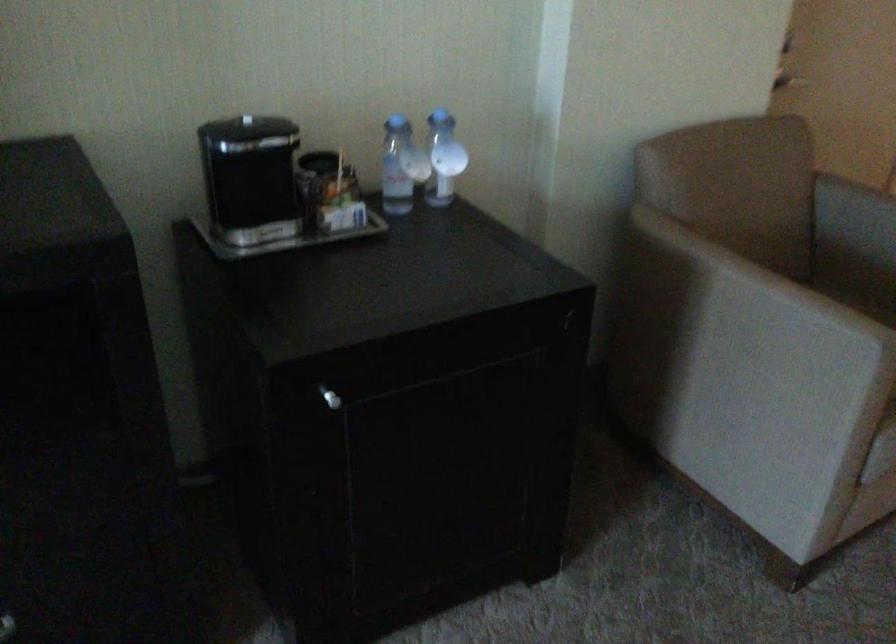
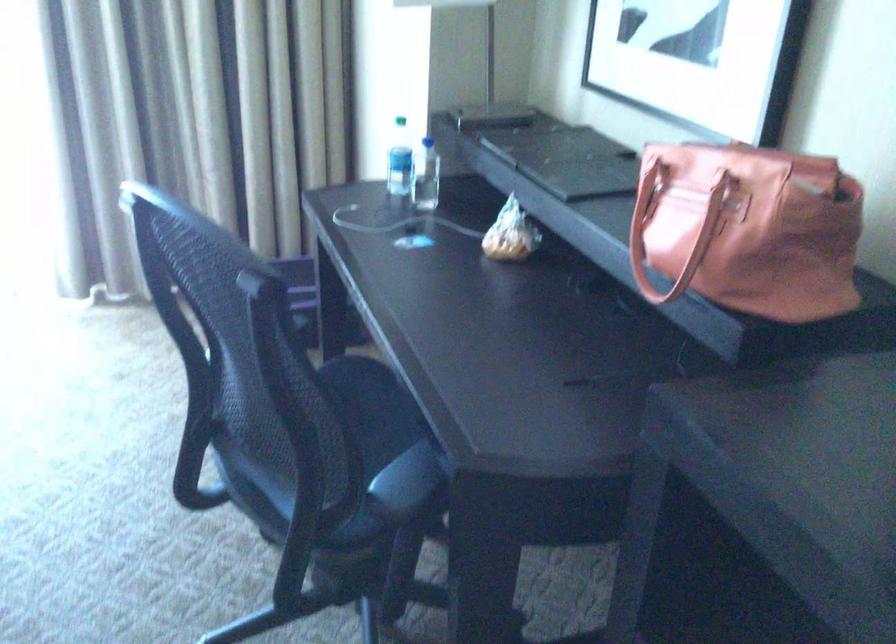
How did the camera likely rotate?

The camera rotated toward left-down.